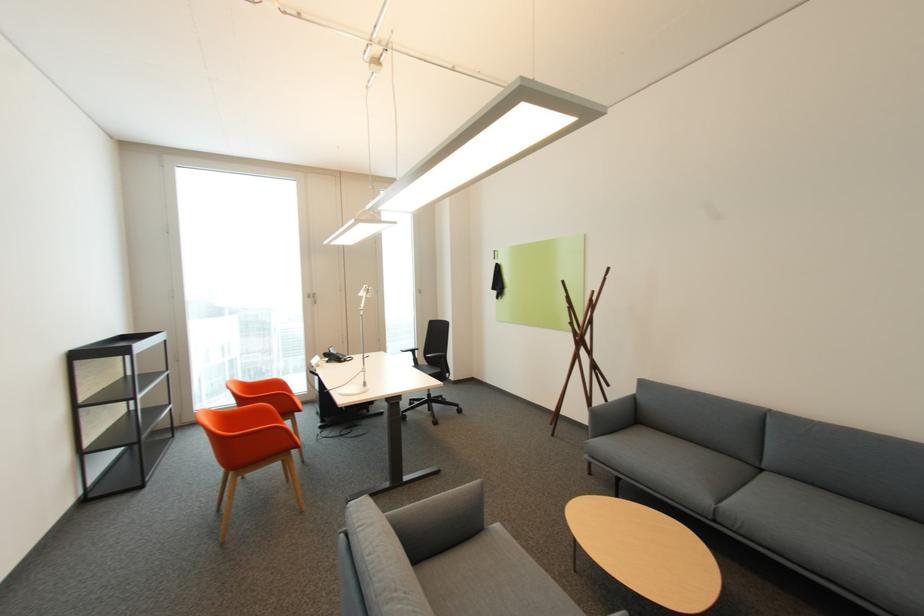
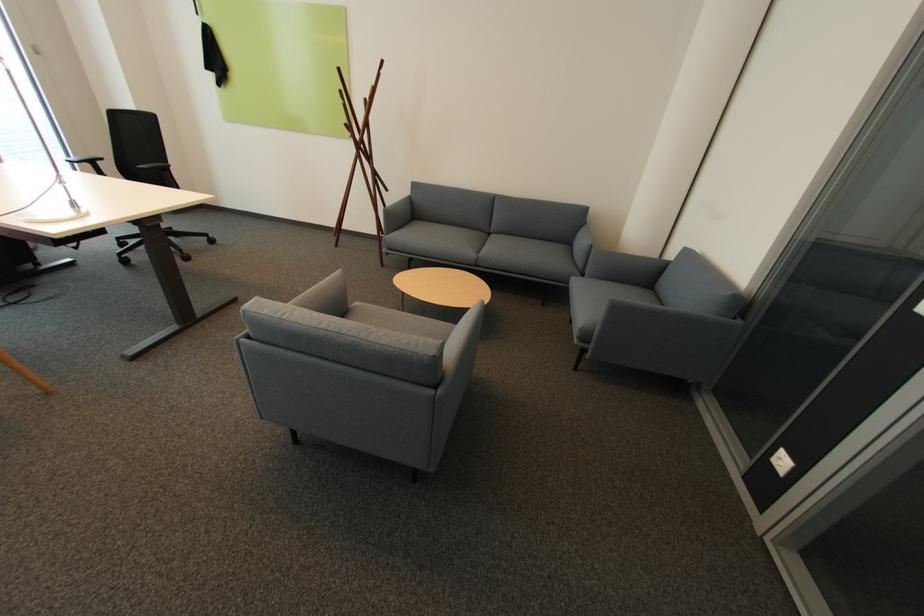
In the second image, find the point that corresponds to pixel 723 522 in the first image.

(482, 265)